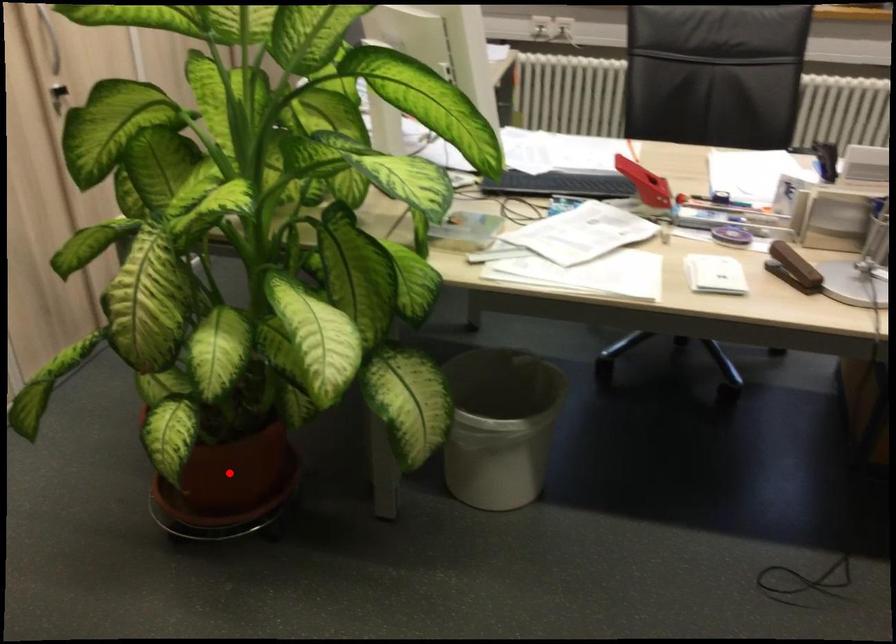
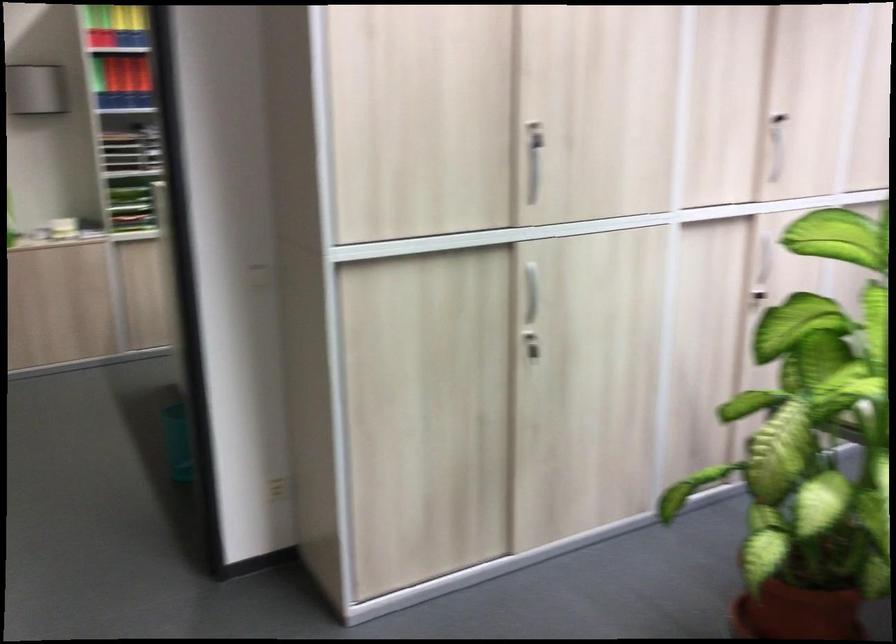
Question: I am providing you with two images of the same scene from different viewpoints. A red point is shown in image1. For the corresponding object point in image2, is it positioned nearer or farther from the camera?

Choices:
 (A) Nearer
 (B) Farther

Answer: (B)